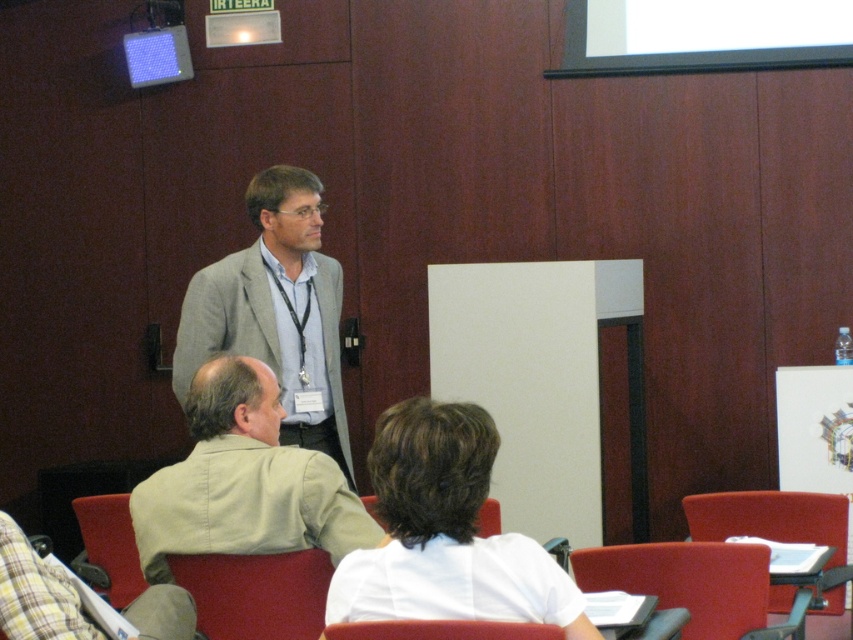
Between velvet-like red chair at lower right and red fabric chair at lower center, which one has more height?

With more height is velvet-like red chair at lower right.

Who is higher up, velvet-like red chair at lower right or red fabric chair at lower center?

Positioned higher is red fabric chair at lower center.

What are the coordinates of `velvet-like red chair at lower right` in the screenshot? It's located at (689, 582).

Find the location of a particular element. velvet-like red chair at lower right is located at coordinates (689, 582).

Find the location of `velvet-like red chair at lower right`. velvet-like red chair at lower right is located at coordinates (689, 582).

Between light beige shirt at lower left and smooth red chair at lower center, which one is positioned lower?

smooth red chair at lower center is lower down.

Does point (195, 509) come behind point (555, 627)?

That is True.

Locate an element on the screen. This screenshot has height=640, width=853. light beige shirt at lower left is located at coordinates (242, 481).